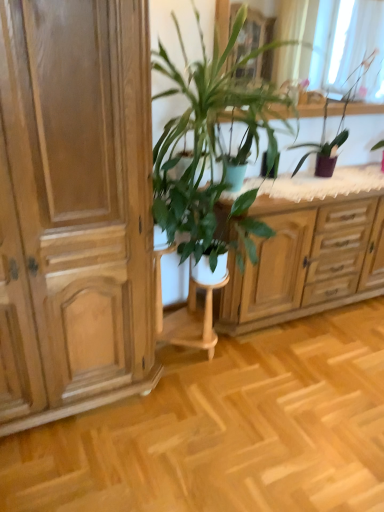
Question: From a real-world perspective, is light brown wood cabinet at left over green matte flowerpot at center?

Choices:
 (A) no
 (B) yes

Answer: (A)

Question: Does light brown wood cabinet at left touch green matte flowerpot at center?

Choices:
 (A) yes
 (B) no

Answer: (B)

Question: From a real-world perspective, is light brown wood cabinet at left below green matte flowerpot at center?

Choices:
 (A) yes
 (B) no

Answer: (A)

Question: Does light brown wood cabinet at left come in front of green matte flowerpot at center?

Choices:
 (A) no
 (B) yes

Answer: (B)

Question: Is light brown wood cabinet at left thinner than green matte flowerpot at center?

Choices:
 (A) no
 (B) yes

Answer: (A)

Question: In the image, is purple glossy vase at upper right, which is the first houseplant from right to left, on the left side or the right side of green matte flowerpot at center?

Choices:
 (A) left
 (B) right

Answer: (B)

Question: Is point (x=332, y=154) positioned closer to the camera than point (x=271, y=175)?

Choices:
 (A) closer
 (B) farther

Answer: (B)

Question: From the image's perspective, is purple glossy vase at upper right, which ranks as the second houseplant in left-to-right order, located above or below green matte flowerpot at center?

Choices:
 (A) below
 (B) above

Answer: (B)

Question: In the image, is purple glossy vase at upper right, which ranks as the second houseplant in left-to-right order, positioned in front of or behind green matte flowerpot at center?

Choices:
 (A) front
 (B) behind

Answer: (A)

Question: From a real-world perspective, relative to green matte flowerpot at center, is green leafy plant at center, which is the second houseplant in right-to-left order, vertically above or below?

Choices:
 (A) above
 (B) below

Answer: (A)

Question: Is green leafy plant at center, which is the first houseplant in left-to-right order, wider or thinner than green matte flowerpot at center?

Choices:
 (A) thin
 (B) wide

Answer: (B)

Question: From the image's perspective, is green leafy plant at center, which is the first houseplant in left-to-right order, above or below green matte flowerpot at center?

Choices:
 (A) below
 (B) above

Answer: (B)

Question: Is green leafy plant at center, which is the first houseplant in left-to-right order, taller or shorter than green matte flowerpot at center?

Choices:
 (A) short
 (B) tall

Answer: (B)

Question: Relative to purple glossy vase at upper right, which is the first houseplant from right to left, is green matte flowerpot at center in front or behind?

Choices:
 (A) front
 (B) behind

Answer: (B)

Question: Is green matte flowerpot at center wider or thinner than purple glossy vase at upper right, which ranks as the second houseplant in left-to-right order?

Choices:
 (A) thin
 (B) wide

Answer: (A)